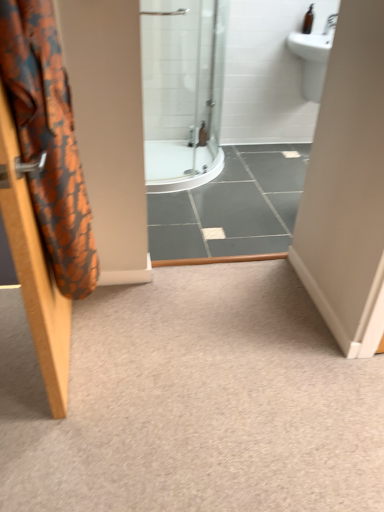
Question: Looking at their shapes, would you say orange fabric shower curtain at left is wider or thinner than carpet at center?

Choices:
 (A) thin
 (B) wide

Answer: (A)

Question: Considering their positions, is orange fabric shower curtain at left located in front of or behind carpet at center?

Choices:
 (A) front
 (B) behind

Answer: (A)

Question: Which object is positioned farthest from the brown glass bottle at upper right?

Choices:
 (A) carpet at center
 (B) orange fabric shower curtain at left

Answer: (B)

Question: Estimate the real-world distances between objects in this image. Which object is farther from the carpet at center?

Choices:
 (A) brown glass bottle at upper right
 (B) orange fabric shower curtain at left

Answer: (A)